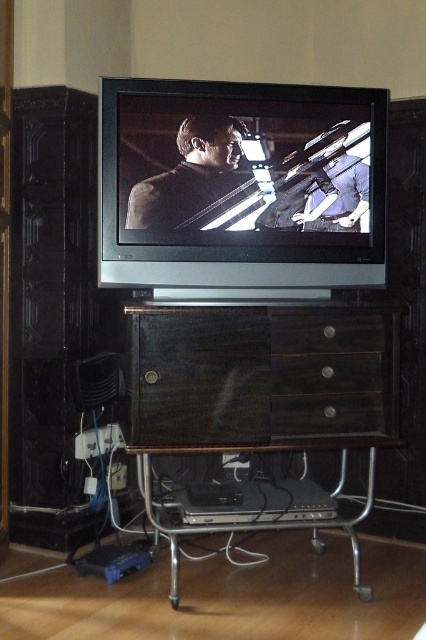
Is silver metallic flat screen tv at center further to camera compared to dark wood drawer at center?

Yes, silver metallic flat screen tv at center is behind dark wood drawer at center.

Does point (131, 285) lie in front of point (357, 339)?

No, (131, 285) is behind (357, 339).

Find the location of a particular element. The width and height of the screenshot is (426, 640). silver metallic flat screen tv at center is located at coordinates (241, 184).

Find the location of a particular element. The image size is (426, 640). silver metallic flat screen tv at center is located at coordinates (241, 184).

Is point (250, 465) positioned in front of point (316, 394)?

No.

Who is taller, dark wood cabinet at center or dark wood drawer at center?

dark wood cabinet at center is taller.

Who is more distant from viewer, (370,593) or (316,412)?

The point (316,412) is behind.

Identify the location of dark wood cabinet at center. (258, 413).

Is matte black suit at center bigger than brown wood drawer at center?

Yes, matte black suit at center is bigger than brown wood drawer at center.

The image size is (426, 640). Find the location of `matte black suit at center`. matte black suit at center is located at coordinates (193, 176).

Between point (236, 179) and point (305, 308), which one is positioned behind?

Positioned behind is point (236, 179).

Where is `matte black suit at center`? The height and width of the screenshot is (640, 426). matte black suit at center is located at coordinates (193, 176).